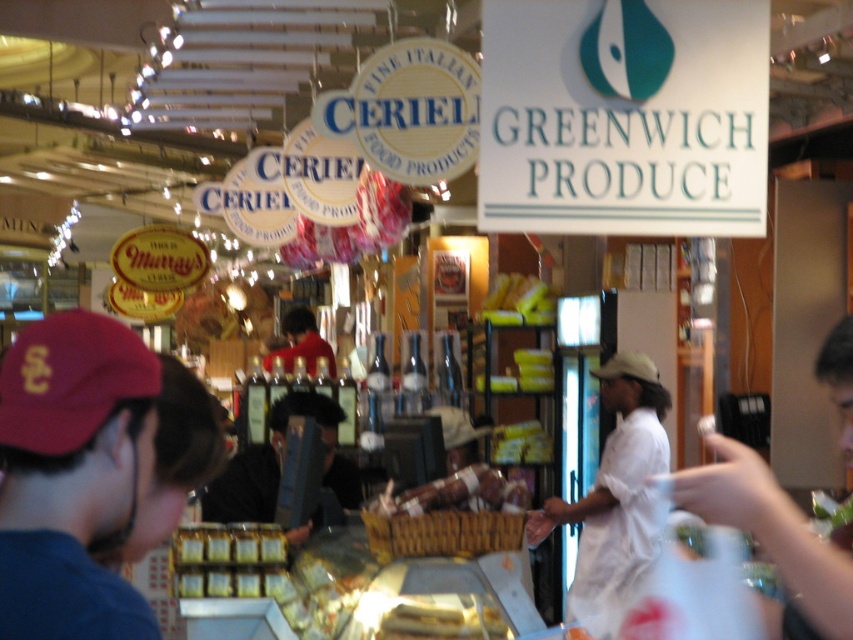
Question: Does white cotton shirt at center appear over golden brown pastry at center?

Choices:
 (A) yes
 (B) no

Answer: (B)

Question: Among these objects, which one is farthest from the camera?

Choices:
 (A) shiny red candy at center
 (B) white cotton shirt at center

Answer: (A)

Question: In this image, where is maroon fabric cap at left located relative to shiny red candy at center?

Choices:
 (A) above
 (B) below

Answer: (B)

Question: Is white cotton shirt at center further to camera compared to black fabric at center?

Choices:
 (A) no
 (B) yes

Answer: (B)

Question: Which object is the farthest from the black fabric at center?

Choices:
 (A) maroon fabric cap at left
 (B) white cotton shirt at center

Answer: (A)

Question: Which of the following is the farthest from the observer?

Choices:
 (A) golden brown pastry at center
 (B) white cotton shirt at center
 (C) shiny red candy at center

Answer: (C)